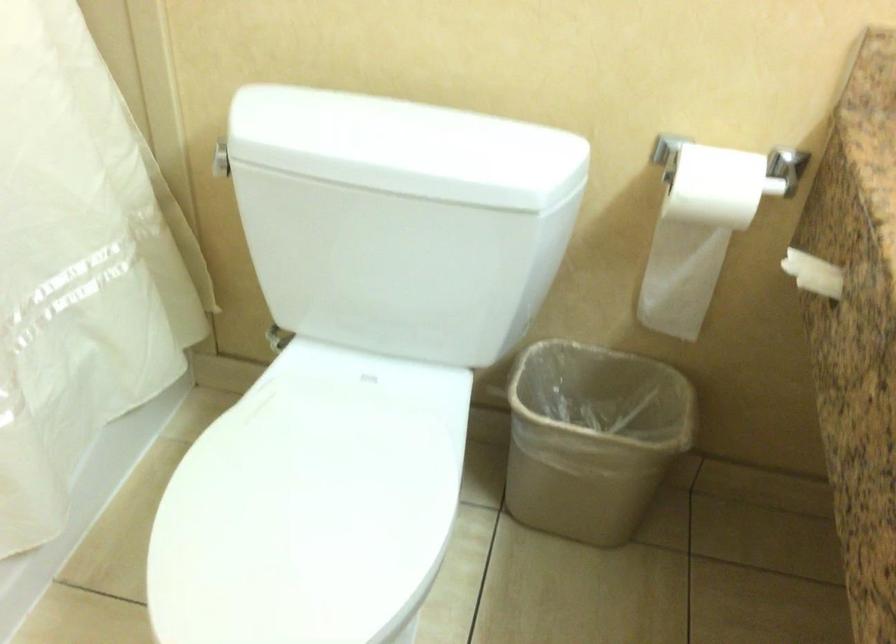
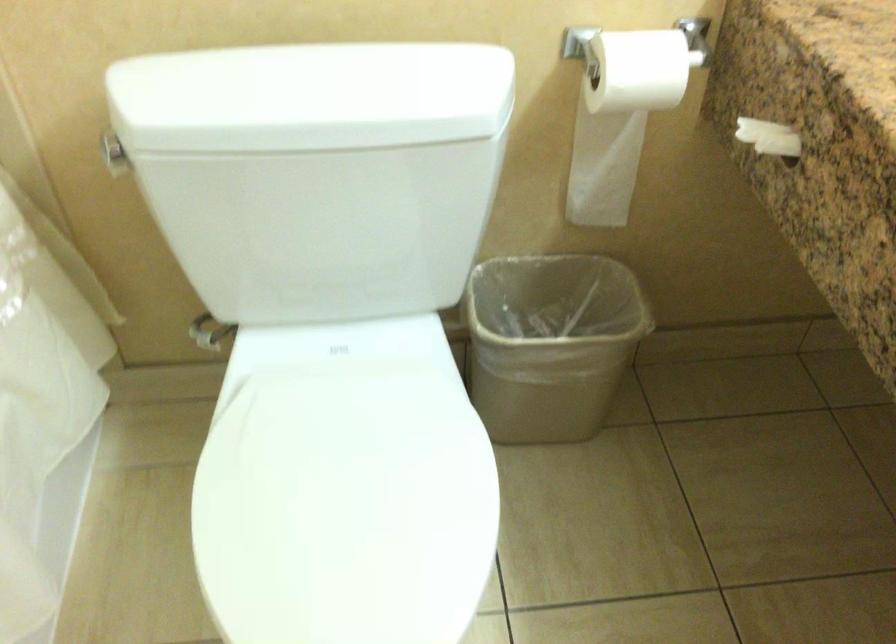
The images are taken continuously from a first-person perspective. In which direction are you moving?

The cameraman moved toward left, forward.